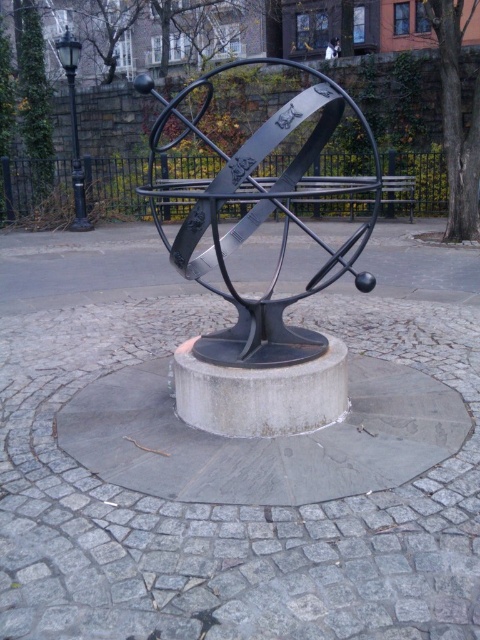
Question: Is black metal sculpture at center bigger than metallic park bench at center?

Choices:
 (A) yes
 (B) no

Answer: (A)

Question: Can you confirm if black metal sculpture at center is positioned to the right of metallic park bench at center?

Choices:
 (A) no
 (B) yes

Answer: (A)

Question: Which object is closer to the camera taking this photo?

Choices:
 (A) metallic park bench at center
 (B) black metal sculpture at center

Answer: (B)

Question: Among these points, which one is nearest to the camera?

Choices:
 (A) (156, 186)
 (B) (257, 189)

Answer: (A)

Question: Does black metal sculpture at center have a smaller size compared to metallic park bench at center?

Choices:
 (A) no
 (B) yes

Answer: (A)

Question: Which point is closer to the camera taking this photo?

Choices:
 (A) (173, 241)
 (B) (361, 176)

Answer: (A)